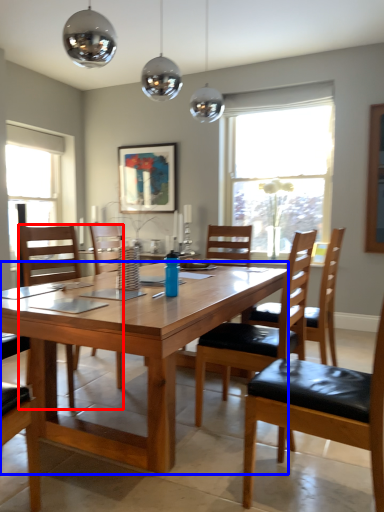
Question: Which point is closer to the camera, chair (highlighted by a red box) or desk (highlighted by a blue box)?

Choices:
 (A) chair
 (B) desk

Answer: (B)